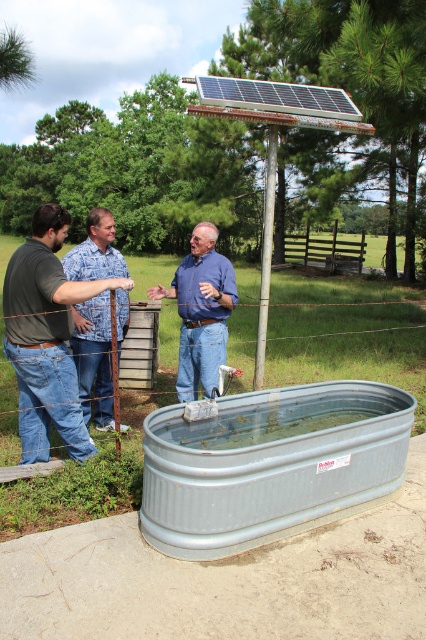
Question: Which object is positioned closest to the brushed metal water tank at lower center?

Choices:
 (A) blue denim jeans at center
 (B) matte black shirt at center
 (C) metallic gray water at center

Answer: (B)

Question: Can you confirm if galvanized metal tub at lower center is positioned above brushed metal water tank at lower center?

Choices:
 (A) yes
 (B) no

Answer: (B)

Question: Which object is farther from the camera taking this photo?

Choices:
 (A) metallic gray water at center
 (B) matte black shirt at center
 (C) galvanized metal tub at lower center
 (D) brushed metal water tank at lower center

Answer: (D)

Question: Observing the image, what is the correct spatial positioning of blue denim jeans at center in reference to brushed metal water tank at lower center?

Choices:
 (A) below
 (B) above

Answer: (A)

Question: Is brushed metal water tank at lower center in front of metallic gray water at center?

Choices:
 (A) no
 (B) yes

Answer: (A)

Question: Which object is closer to the camera taking this photo?

Choices:
 (A) galvanized metal tub at lower center
 (B) matte black shirt at center

Answer: (A)